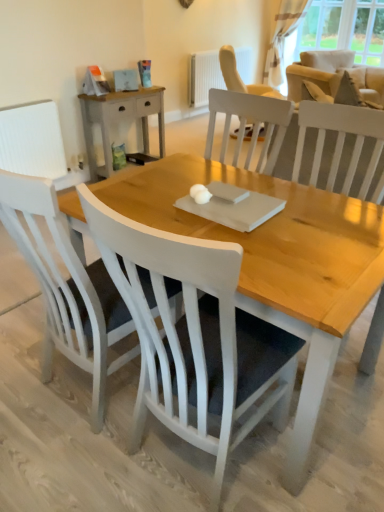
Find the location of a particular element. The height and width of the screenshot is (512, 384). free area below white matte chair at lower left, arranged as the 1th chair when viewed from the left (from a real-world perspective) is located at coordinates (87, 400).